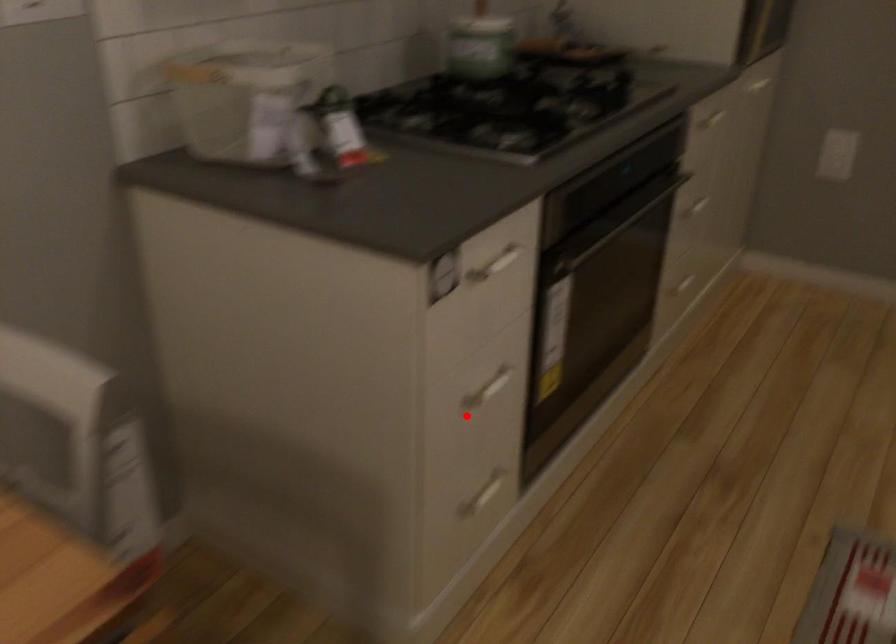
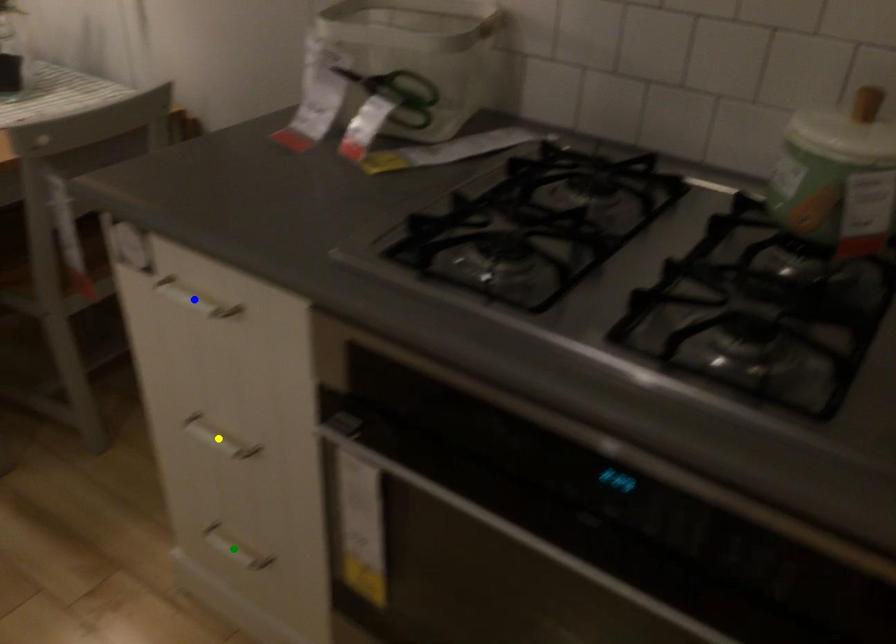
Question: I am providing you with two images of the same scene from different viewpoints. A red point is marked on the first image. You are given multiple points on the second image. In image 2, which mark is for the same physical point as the one in image 1?

Choices:
 (A) yellow point
 (B) blue point
 (C) green point

Answer: (A)